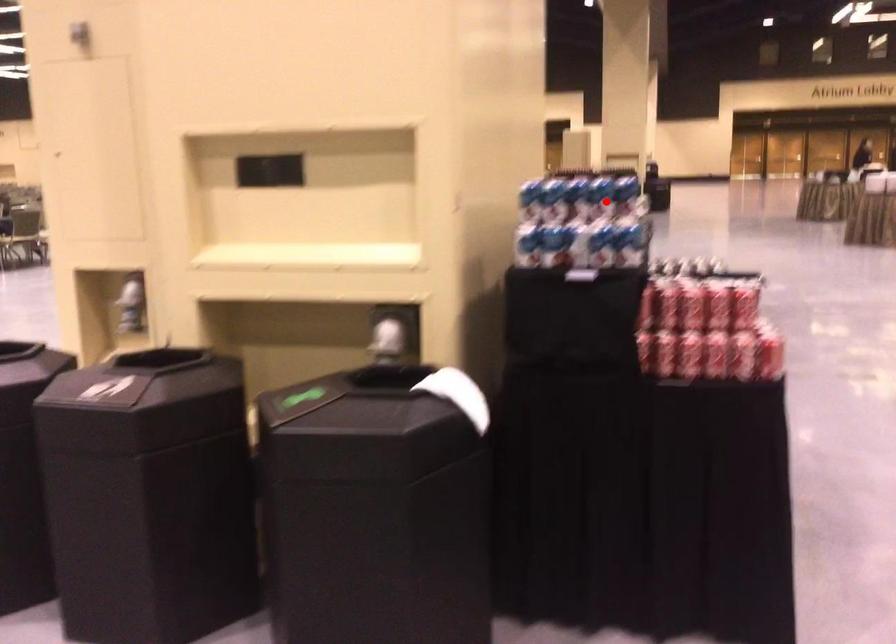
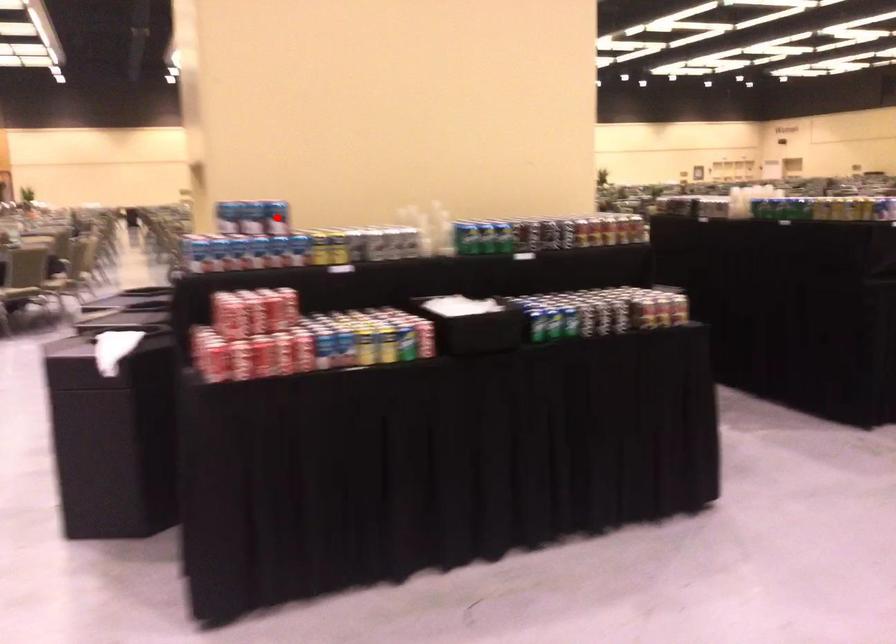
I am providing you with two images of the same scene from different viewpoints. A red point is marked on the first image and another point is marked on the second image. Are the points marked in image1 and image2 representing the same 3D position?

No